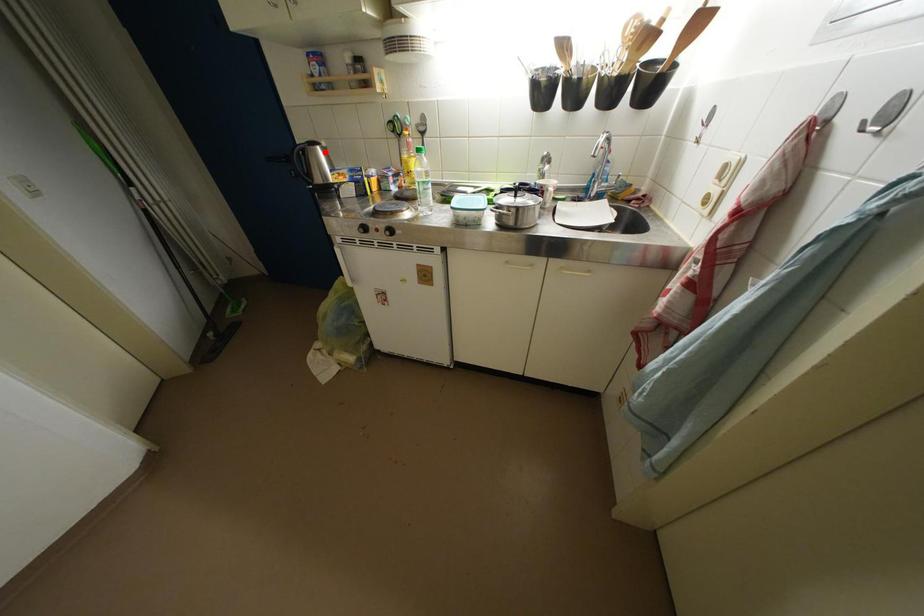
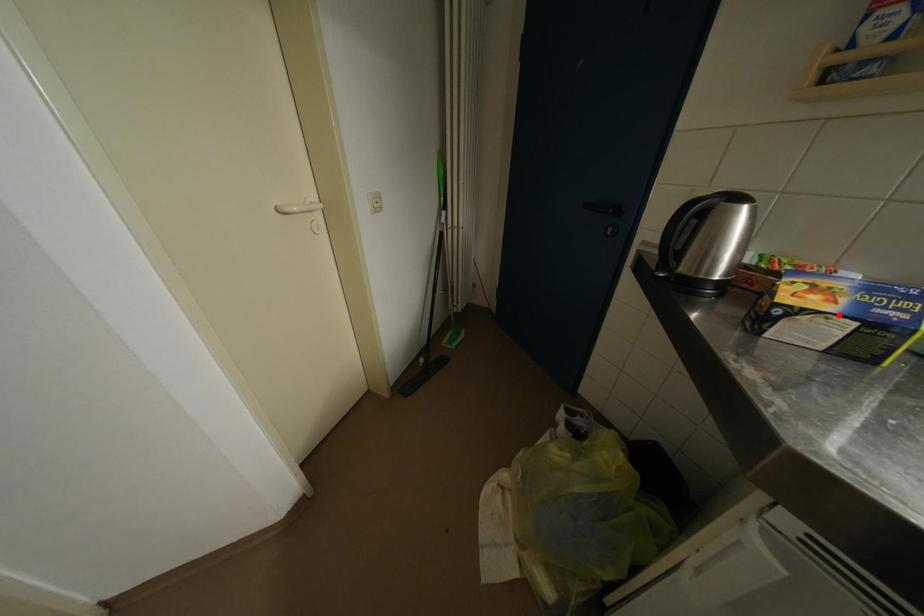
I am providing you with two images of the same scene from different viewpoints. A red point is marked on the first image and another point is marked on the second image. Do the highlighted points in image1 and image2 indicate the same real-world spot?

No